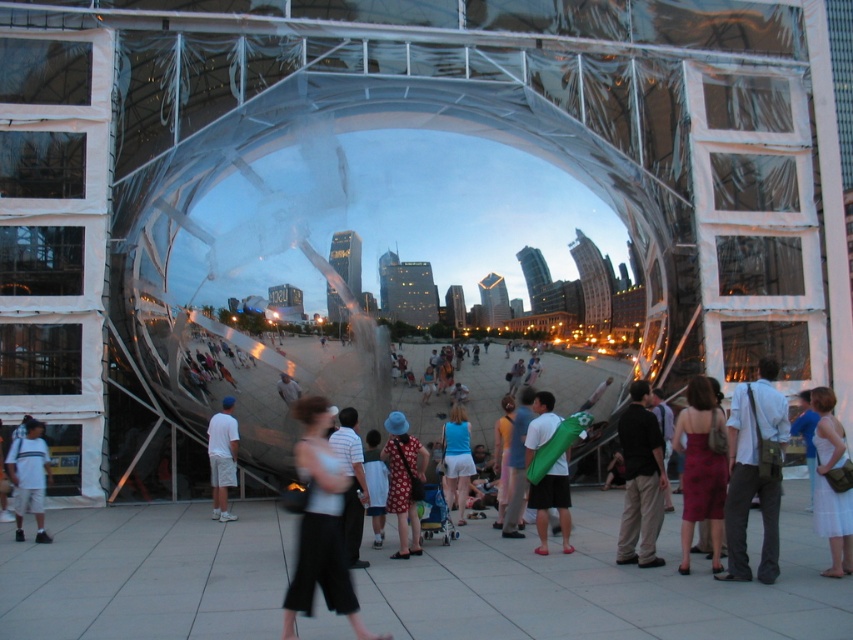
Question: Can you confirm if matte red dress at center is wider than matte blue shorts at center?

Choices:
 (A) yes
 (B) no

Answer: (A)

Question: Which object appears farthest from the camera in this image?

Choices:
 (A) white cotton dress at lower right
 (B) matte white pants at center
 (C) matte blue shorts at center

Answer: (C)

Question: Which of the following is the closest to the observer?

Choices:
 (A) (334, 522)
 (B) (544, 396)
 (C) (47, 458)

Answer: (A)

Question: Can you confirm if matte white pants at center is smaller than green fabric bag at center?

Choices:
 (A) no
 (B) yes

Answer: (A)

Question: Does dark brown pants at lower right have a smaller size compared to white cotton shirt at lower left?

Choices:
 (A) no
 (B) yes

Answer: (A)

Question: Which of the following is the farthest from the observer?

Choices:
 (A) (228, 454)
 (B) (538, 413)
 (C) (39, 509)

Answer: (A)